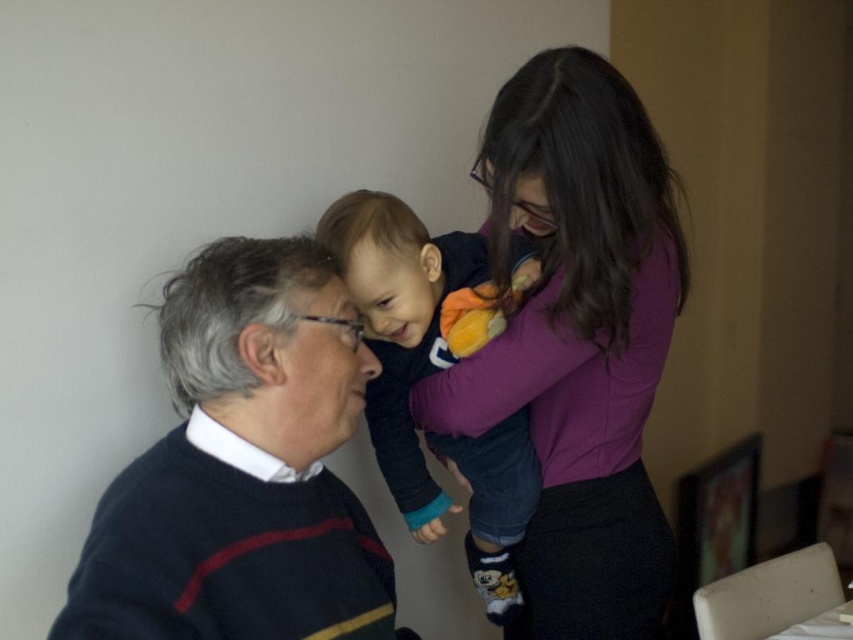
Who is lower down, purple matte shirt at upper right or dark blue fleece at center?

dark blue fleece at center is below.

Does point (526, 90) come closer to viewer compared to point (395, 445)?

Yes, point (526, 90) is in front of point (395, 445).

Who is more forward, (x=543, y=64) or (x=485, y=275)?

Point (x=543, y=64) is more forward.

The width and height of the screenshot is (853, 640). I want to click on purple matte shirt at upper right, so click(577, 340).

Which of these two, purple matte shirt at upper right or dark blue sweater at left, stands taller?

With more height is purple matte shirt at upper right.

Is point (619, 467) closer to viewer compared to point (326, 477)?

No.

Where is `purple matte shirt at upper right`? The height and width of the screenshot is (640, 853). purple matte shirt at upper right is located at coordinates (577, 340).

Which is more to the right, dark blue sweater at left or dark blue fleece at center?

dark blue fleece at center

Can you confirm if dark blue sweater at left is bigger than dark blue fleece at center?

Incorrect, dark blue sweater at left is not larger than dark blue fleece at center.

Measure the distance between dark blue sweater at left and camera.

31.41 inches

This screenshot has height=640, width=853. In order to click on dark blue sweater at left in this screenshot , I will do (x=242, y=468).